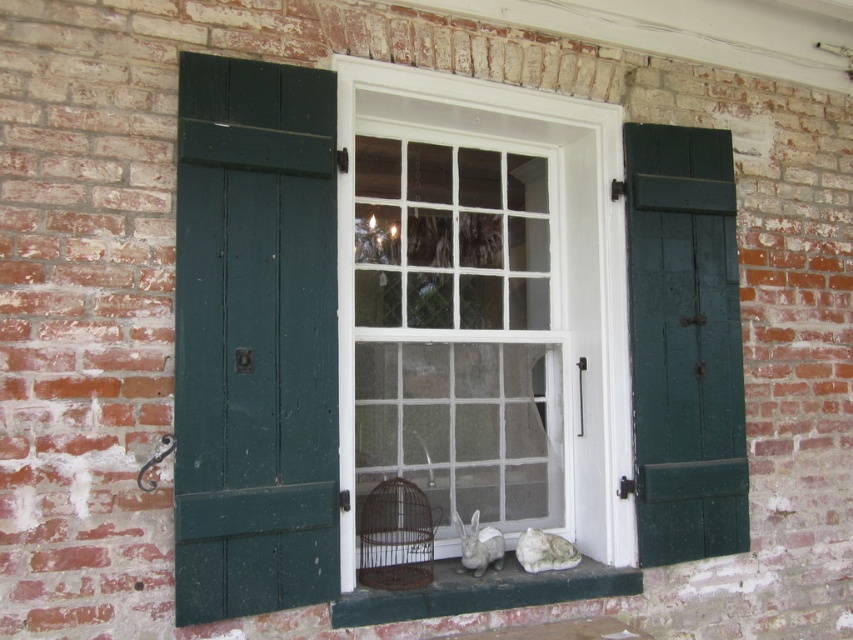
Question: Estimate the real-world distances between objects in this image. Which object is closer to the green painted wood at lower center?

Choices:
 (A) green painted wood at right
 (B) green wood shutter at left
 (C) white painted wood window frame at center

Answer: (C)

Question: Which point is closer to the camera?

Choices:
 (A) (456, 365)
 (B) (741, 547)

Answer: (A)

Question: Is green wood shutter at left to the right of rusty metal birdcage at center from the viewer's perspective?

Choices:
 (A) yes
 (B) no

Answer: (B)

Question: Estimate the real-world distances between objects in this image. Which object is closer to the green painted wood at lower center?

Choices:
 (A) rusty metal birdcage at center
 (B) white painted wood window frame at center

Answer: (A)

Question: In this image, where is green painted wood at right located relative to green painted wood at lower center?

Choices:
 (A) right
 (B) left

Answer: (A)

Question: Can you confirm if white painted wood window frame at center is smaller than green wood shutter at left?

Choices:
 (A) no
 (B) yes

Answer: (A)